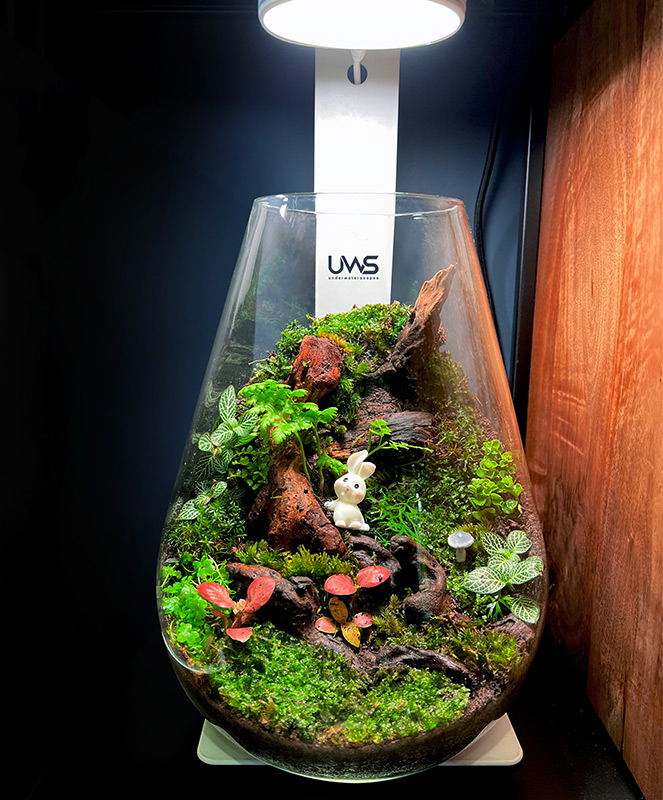
This screenshot has width=663, height=800. What are the coordinates of `cable` in the screenshot? It's located at (488, 189), (353, 61).